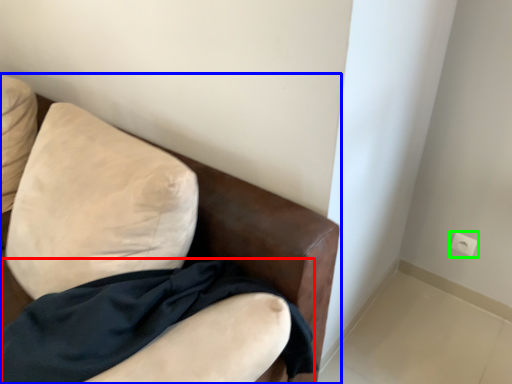
Question: Considering the real-world distances, which object is closest to fabric (highlighted by a red box)? furniture (highlighted by a blue box) or electric outlet (highlighted by a green box).

Choices:
 (A) furniture
 (B) electric outlet

Answer: (A)